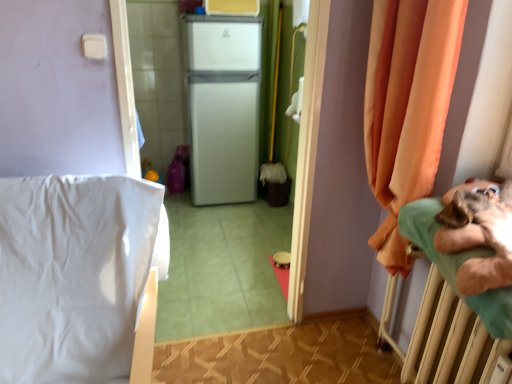
Question: Considering the positions of point (454, 291) and point (245, 46), is point (454, 291) closer or farther from the camera than point (245, 46)?

Choices:
 (A) farther
 (B) closer

Answer: (B)

Question: In terms of size, does green fabric hospital bed at right appear bigger or smaller than white matte refrigerator at center?

Choices:
 (A) small
 (B) big

Answer: (A)

Question: Estimate the real-world distances between objects in this image. Which object is farther from the orange fabric curtain at right?

Choices:
 (A) green fabric hospital bed at right
 (B) white smooth bedsheet at left
 (C) white matte refrigerator at center

Answer: (C)

Question: Which object is positioned closest to the orange fabric curtain at right?

Choices:
 (A) white smooth bedsheet at left
 (B) white matte refrigerator at center
 (C) green fabric hospital bed at right

Answer: (C)